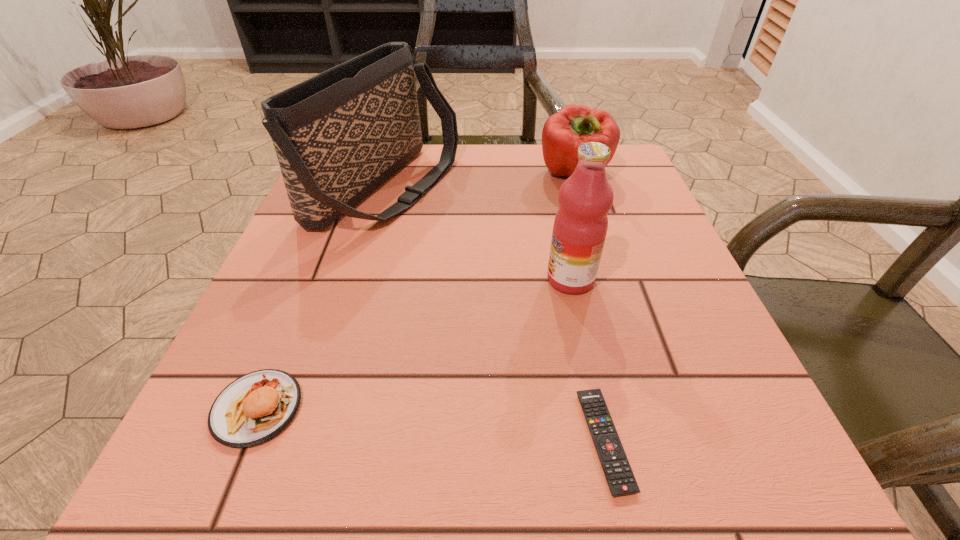
Image resolution: width=960 pixels, height=540 pixels. I want to click on vacant space situated 0.240m on the right of the second shortest object, so click(485, 408).

You are a GUI agent. You are given a task and a screenshot of the screen. Output one action in this format:
    pyautogui.click(x=<x>, y=<y>)
    Task: Click on the vacant point located 0.390m on the back of the remote control
    The image size is (960, 540).
    Given the screenshot: What is the action you would take?
    pyautogui.click(x=557, y=221)

Where is `handbag located at the far edge`? The height and width of the screenshot is (540, 960). handbag located at the far edge is located at coordinates (338, 135).

Find the location of a particular element. Image resolution: width=960 pixels, height=540 pixels. bell pepper present at the far edge is located at coordinates (563, 132).

What are the coordinates of `patty that is at the near edge` in the screenshot? It's located at (255, 407).

Locate an element on the screen. The image size is (960, 540). remote control located in the near edge section of the desktop is located at coordinates (618, 473).

Where is `handbag located in the left edge section of the desktop`? This screenshot has width=960, height=540. handbag located in the left edge section of the desktop is located at coordinates (338, 135).

Find the location of a particular element. patty that is at the left edge is located at coordinates (255, 407).

Find the location of a particular element. This screenshot has height=540, width=960. object that is at the right edge is located at coordinates (563, 132).

Where is `object present at the far left corner`? The image size is (960, 540). object present at the far left corner is located at coordinates (338, 135).